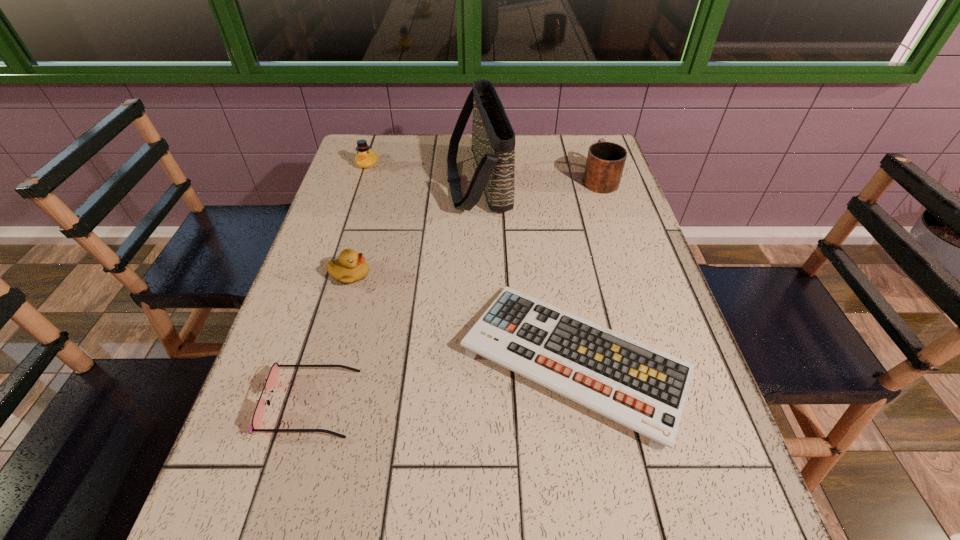
Locate an element on the screen. The width and height of the screenshot is (960, 540). object at the far left corner is located at coordinates (366, 157).

Locate an element on the screen. The height and width of the screenshot is (540, 960). object that is at the far right corner is located at coordinates tap(605, 162).

In the image, there is a desktop. Where is `vacant space at the far edge`? vacant space at the far edge is located at coordinates (424, 136).

What are the coordinates of `vacant position at the left edge of the desktop` in the screenshot? It's located at (284, 484).

Image resolution: width=960 pixels, height=540 pixels. In the image, there is a desktop. What are the coordinates of `vacant space at the right edge` in the screenshot? It's located at [632, 332].

Where is `free spot at the far left corner of the desktop`? free spot at the far left corner of the desktop is located at coordinates [402, 134].

Find the location of a particular element. Image resolution: width=960 pixels, height=540 pixels. vacant space at the far right corner is located at coordinates (585, 154).

Identify the location of free space that is in between the duck and the computer keyboard. The height and width of the screenshot is (540, 960). (471, 262).

Identify the location of free area in between the duckling and the mug. The image size is (960, 540). (474, 226).

The height and width of the screenshot is (540, 960). Identify the location of empty space that is in between the computer keyboard and the handbag. (527, 271).